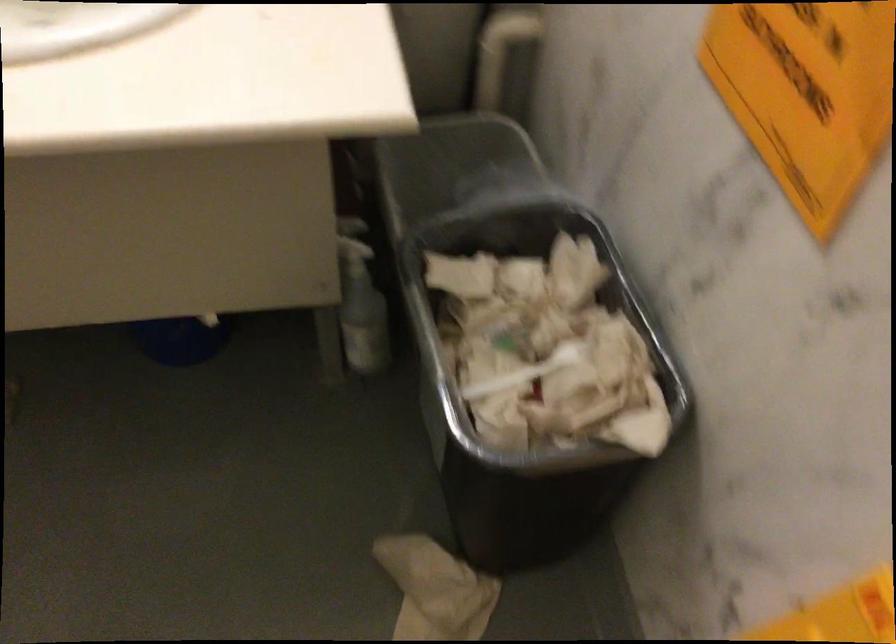
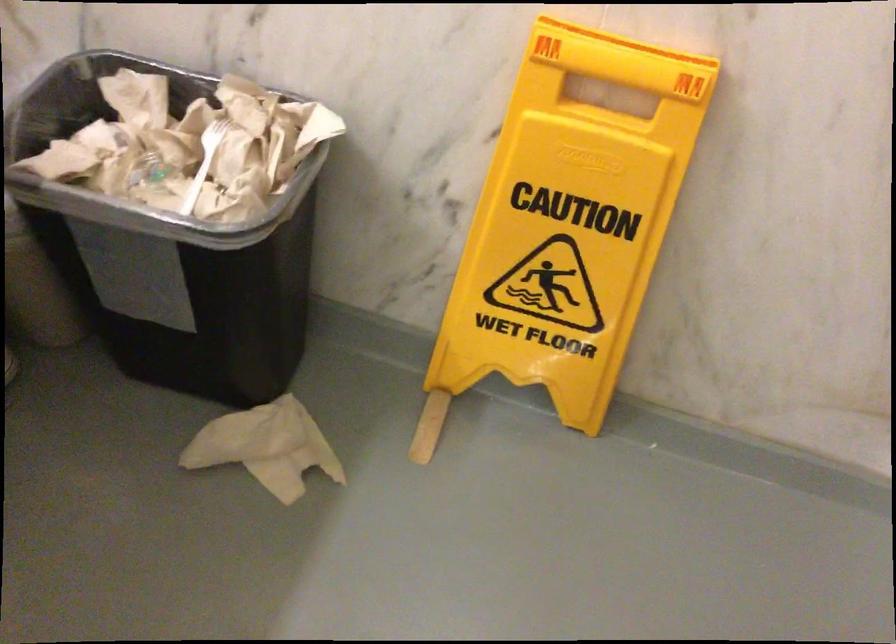
The images are taken continuously from a first-person perspective. In which direction is your viewpoint rotating?

The camera's rotation is toward right-down.